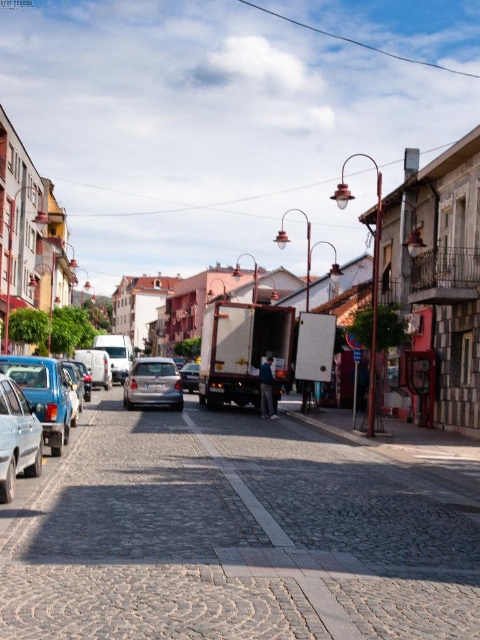
Is matte blue car at center-left positioned in front of satin silver car at center?

Yes, it is in front of satin silver car at center.

Does matte blue car at center-left have a lesser width compared to satin silver car at center?

Yes, matte blue car at center-left is thinner than satin silver car at center.

Measure the distance between matte blue car at center-left and camera.

matte blue car at center-left is 24.40 feet from camera.

Where is `matte blue car at center-left`? Image resolution: width=480 pixels, height=640 pixels. matte blue car at center-left is located at coordinates (32, 416).

Which of these two, matte blue car at center-left or matte silver sedan at center, stands shorter?

With less height is matte silver sedan at center.

Who is lower down, matte blue car at center-left or matte silver sedan at center?

matte silver sedan at center is lower down.

Does point (7, 394) lie in front of point (188, 378)?

Yes, it is.

You are a GUI agent. You are given a task and a screenshot of the screen. Output one action in this format:
    pyautogui.click(x=<x>, y=<y>)
    Task: Click on the matte blue car at center-left
    The width and height of the screenshot is (480, 640).
    Given the screenshot: What is the action you would take?
    pyautogui.click(x=32, y=416)

Does white glossy truck at center have a lesser height compared to satin silver car at center?

No.

Is point (479, 209) more distant than point (122, 396)?

No, it is in front of (122, 396).

Does point (446, 312) come closer to viewer compared to point (137, 371)?

Yes.

You are a GUI agent. You are given a task and a screenshot of the screen. Output one action in this format:
    pyautogui.click(x=<x>, y=<y>)
    Task: Click on the white glossy truck at center
    
    Given the screenshot: What is the action you would take?
    pyautogui.click(x=436, y=268)